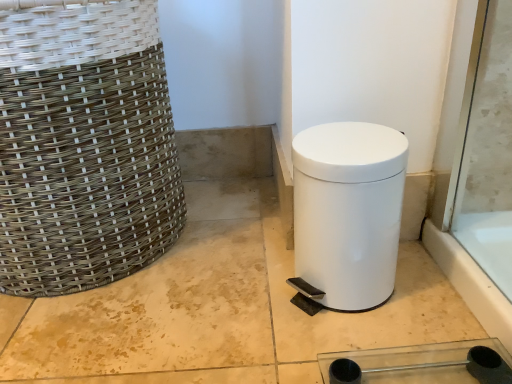
You are a GUI agent. You are given a task and a screenshot of the screen. Output one action in this format:
    pyautogui.click(x=<x>, y=<y>)
    Task: Click on the blank space to the left of white glossy trash can at lower right
    
    Given the screenshot: What is the action you would take?
    pyautogui.click(x=236, y=299)